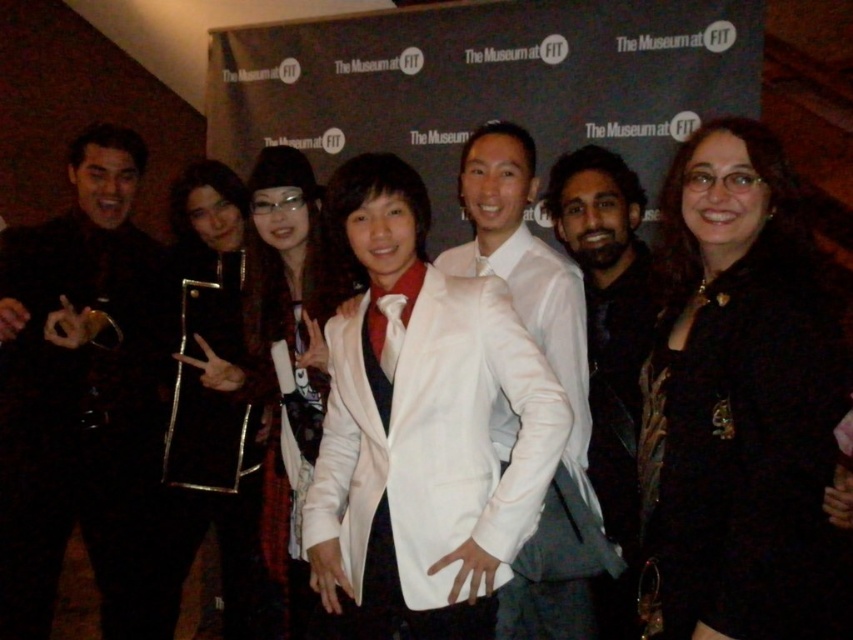
Question: Which point appears closest to the camera in this image?

Choices:
 (A) tap(550, 496)
 (B) tap(229, 317)
 (C) tap(47, 264)

Answer: (A)

Question: Which point is closer to the camera taking this photo?

Choices:
 (A) (556, 602)
 (B) (677, 554)
 (C) (595, 282)
 (D) (531, 433)

Answer: (B)

Question: Does black velvet dress at center appear over white satin blazer at center?

Choices:
 (A) yes
 (B) no

Answer: (A)

Question: Can you confirm if black velvet dress at center is positioned above black textured suit at left?

Choices:
 (A) no
 (B) yes

Answer: (B)

Question: From the image, what is the correct spatial relationship of white satin blazer at center in relation to velvet black coat at center?

Choices:
 (A) right
 (B) left

Answer: (A)

Question: Based on their relative distances, which object is farther from the white satin suit at center?

Choices:
 (A) dark brown leather jacket at center
 (B) velvet black coat at center
 (C) white satin blazer at center

Answer: (B)